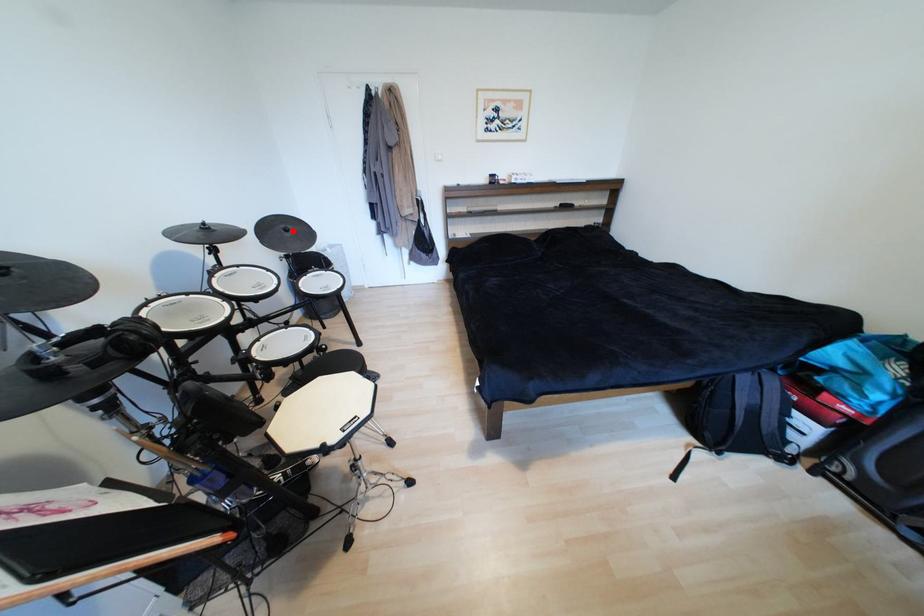
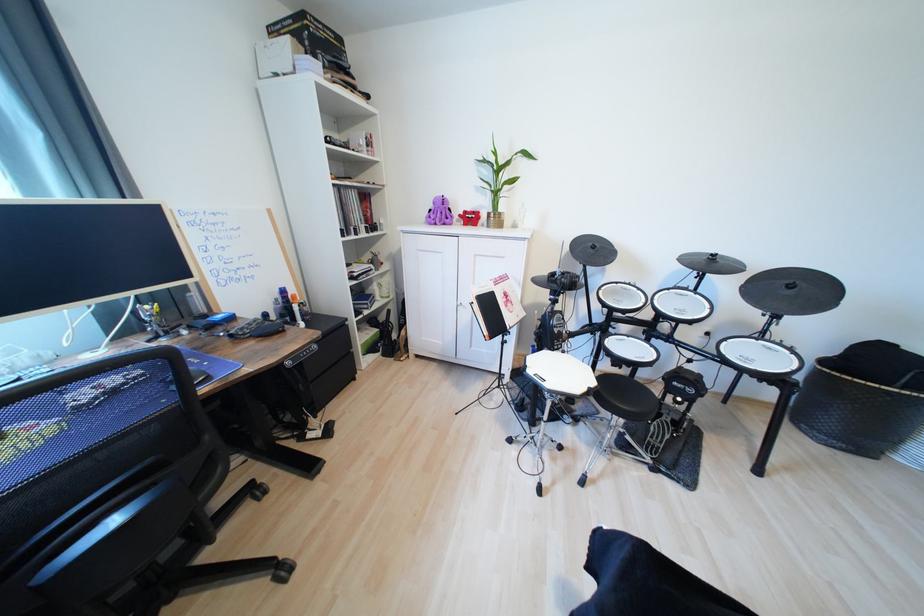
Locate, in the second image, the point that corresponds to the highlighted location in the first image.

(797, 288)